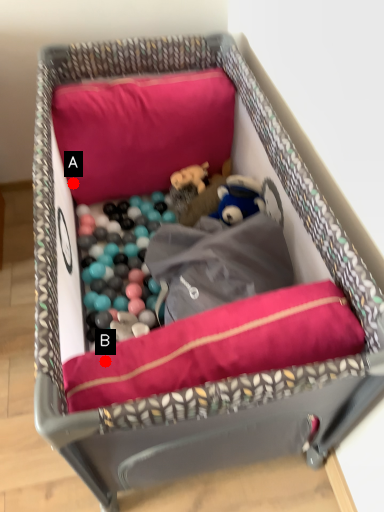
Question: Two points are circled on the image, labeled by A and B beside each circle. Which of the following is the farthest from the observer?

Choices:
 (A) A is further
 (B) B is further

Answer: (A)